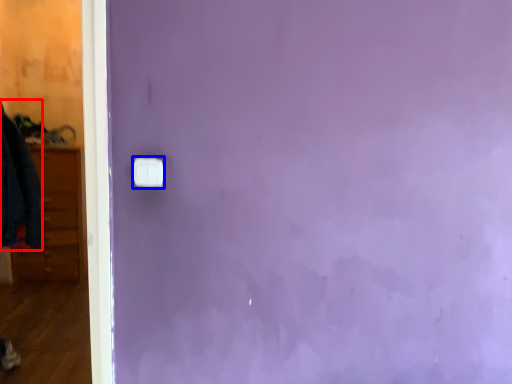
Question: Which object appears closest to the camera in this image, clothing (highlighted by a red box) or light switch (highlighted by a blue box)?

Choices:
 (A) clothing
 (B) light switch

Answer: (B)